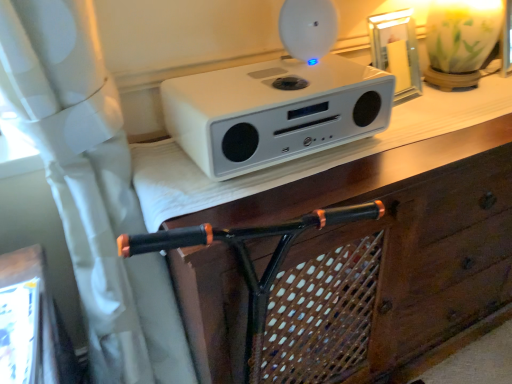
Question: Is white matte speaker at upper center looking in the opposite direction of white matte speaker at upper center?

Choices:
 (A) no
 (B) yes

Answer: (A)

Question: Does white matte speaker at upper center have a lesser height compared to white matte speaker at upper center?

Choices:
 (A) no
 (B) yes

Answer: (A)

Question: Is white matte speaker at upper center positioned far away from white matte speaker at upper center?

Choices:
 (A) no
 (B) yes

Answer: (A)

Question: From the image's perspective, is white matte speaker at upper center located beneath white matte speaker at upper center?

Choices:
 (A) yes
 (B) no

Answer: (A)

Question: Considering the relative sizes of white matte speaker at upper center and white matte speaker at upper center in the image provided, is white matte speaker at upper center bigger than white matte speaker at upper center?

Choices:
 (A) yes
 (B) no

Answer: (A)

Question: From a real-world perspective, is white matte speaker at upper center physically above white matte speaker at upper center?

Choices:
 (A) yes
 (B) no

Answer: (B)

Question: Considering the relative sizes of white matte speaker at upper center and white matte speaker at upper center in the image provided, is white matte speaker at upper center wider than white matte speaker at upper center?

Choices:
 (A) yes
 (B) no

Answer: (B)

Question: Is white matte speaker at upper center shorter than white matte speaker at upper center?

Choices:
 (A) yes
 (B) no

Answer: (A)

Question: Is white matte speaker at upper center surrounding white matte speaker at upper center?

Choices:
 (A) no
 (B) yes

Answer: (A)

Question: Is white matte speaker at upper center beside white matte speaker at upper center?

Choices:
 (A) no
 (B) yes

Answer: (A)

Question: From a real-world perspective, is white matte speaker at upper center positioned under white matte speaker at upper center based on gravity?

Choices:
 (A) yes
 (B) no

Answer: (B)

Question: Is white matte speaker at upper center closer to camera compared to white matte speaker at upper center?

Choices:
 (A) yes
 (B) no

Answer: (B)

Question: From their relative heights in the image, would you say white matte speaker at upper center is taller or shorter than white matte speaker at upper center?

Choices:
 (A) tall
 (B) short

Answer: (A)